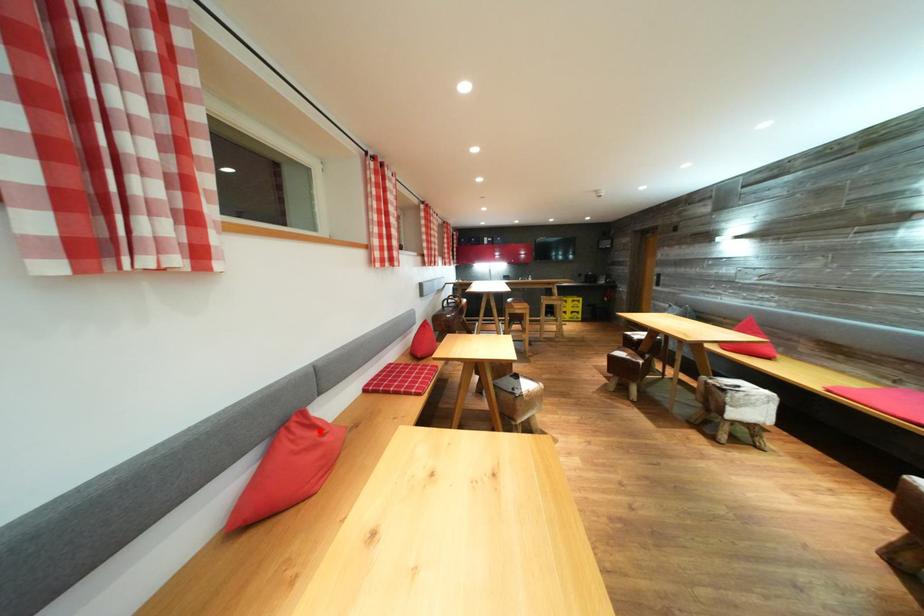
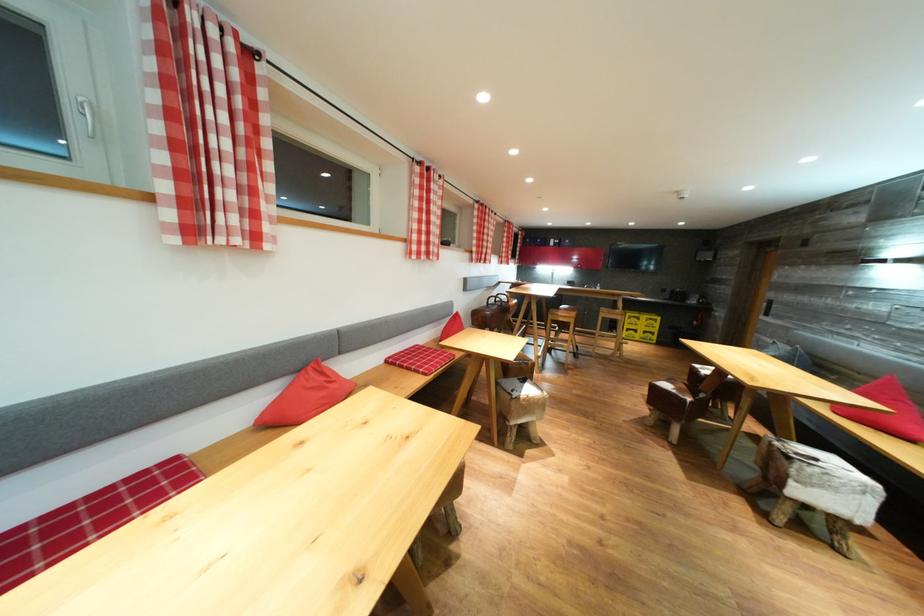
Question: I am providing you with two images of the same scene from different viewpoints. In image1, a red point is highlighted. Considering the same 3D point in image2, which of the following is correct?

Choices:
 (A) It is closer
 (B) It is farther

Answer: (B)